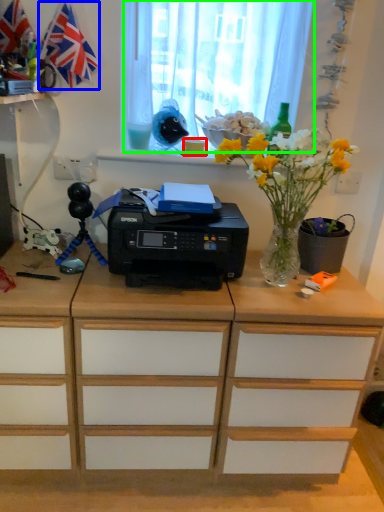
Question: Based on their relative distances, which object is farther from stationery (highlighted by a red box)? Choose from flag (highlighted by a blue box) and curtain (highlighted by a green box).

Choices:
 (A) flag
 (B) curtain

Answer: (A)